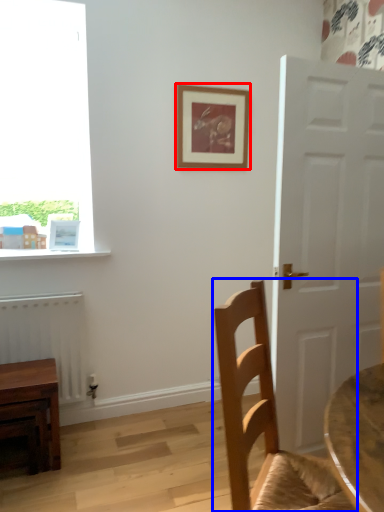
Question: Which point is closer to the camera, picture frame (highlighted by a red box) or chair (highlighted by a blue box)?

Choices:
 (A) picture frame
 (B) chair

Answer: (B)